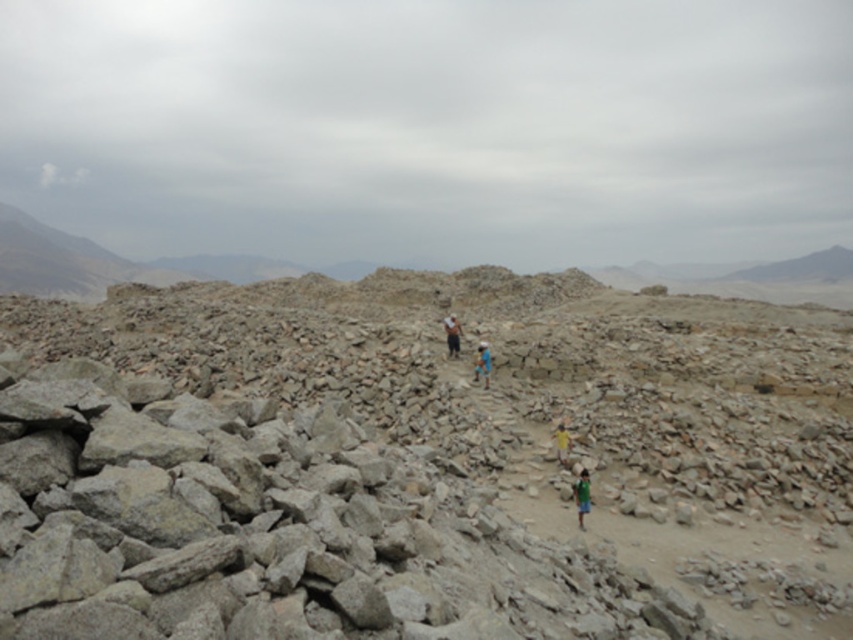
You are a photographer positioned at the edge of the rocky terrain. You want to capture a photo of both the green fabric shirt at center and the blue fabric shirt at center in the midground. Which person should you focus on first to ensure they are in the frame?

The green fabric shirt at center is shorter than the blue fabric shirt at center, so you should focus on the green fabric shirt at center first to ensure it is in the frame since it is closer to the photographer.

You are a hiker trying to navigate through the rocky terrain. You see the blue fabric shirt at center and the yellow fabric person at center. Which one is closer to you?

The blue fabric shirt at center is closer to you because the yellow fabric person at center is behind it.

You are a hiker looking at the rocky landscape. You see a blue fabric shirt at center and a light blue fabric at center. Which one is lower in the image?

The blue fabric shirt at center is below light blue fabric at center, so the blue fabric shirt at center is lower in the image.